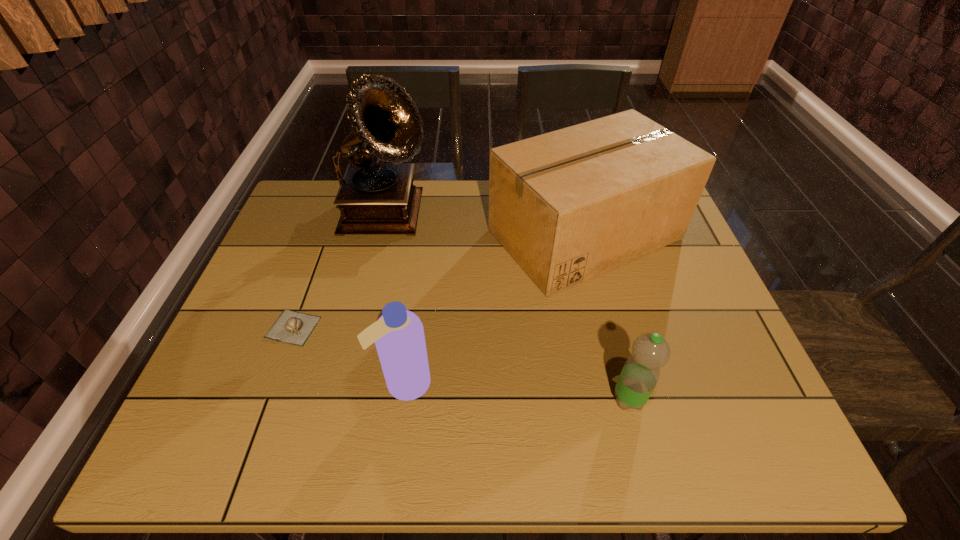
Find the location of a particular element. The width and height of the screenshot is (960, 540). free point between the fourth tallest object and the shampoo is located at coordinates (516, 391).

Identify the location of vacant area between the record player and the third nearest object. click(341, 272).

I want to click on free space between the record player and the shampoo, so click(x=396, y=300).

This screenshot has width=960, height=540. Find the location of `free space between the record player and the box`. free space between the record player and the box is located at coordinates (486, 226).

Image resolution: width=960 pixels, height=540 pixels. Identify the location of free spot between the garlic and the tallest object. (341, 272).

The height and width of the screenshot is (540, 960). I want to click on vacant point located between the third nearest object and the fourth tallest object, so click(461, 363).

At what (x,y) coordinates should I click in order to perform the action: click on free space between the box and the tallest object. Please return your answer as a coordinate pair (x, y). This screenshot has height=540, width=960. Looking at the image, I should click on (486, 226).

Locate an element on the screen. vacant point located between the third nearest object and the fourth tallest object is located at coordinates (461, 363).

Image resolution: width=960 pixels, height=540 pixels. In order to click on vacant space in between the record player and the box in this screenshot , I will do [x=486, y=226].

At what (x,y) coordinates should I click in order to perform the action: click on free point between the box and the shampoo. Please return your answer as a coordinate pair (x, y). Looking at the image, I should click on (494, 309).